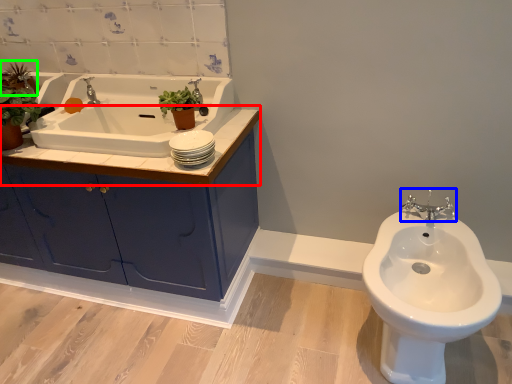
Question: Which is farther away from counter top (highlighted by a red box)? tap (highlighted by a blue box) or plant (highlighted by a green box)?

Choices:
 (A) tap
 (B) plant

Answer: (A)